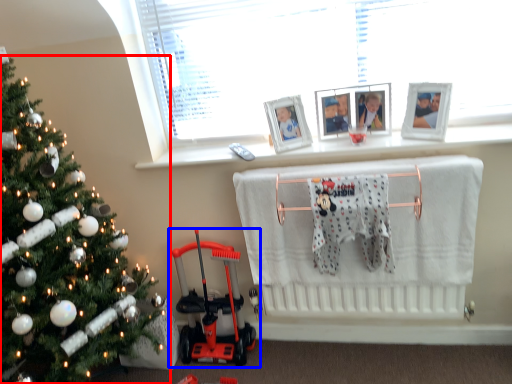
Question: Which point is further to the camera, christmas tree (highlighted by a red box) or toy (highlighted by a blue box)?

Choices:
 (A) christmas tree
 (B) toy

Answer: (B)